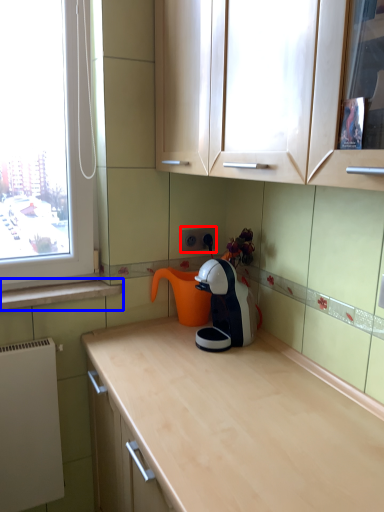
Question: Which object appears farthest to the camera in this image, electric outlet (highlighted by a red box) or window sill (highlighted by a blue box)?

Choices:
 (A) electric outlet
 (B) window sill

Answer: (A)